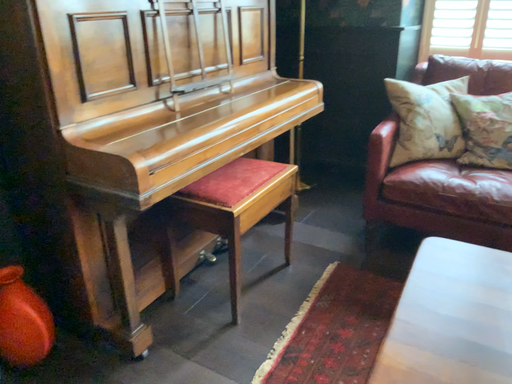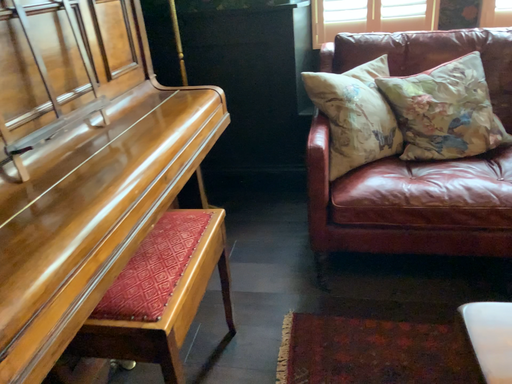
Question: How did the camera likely rotate when shooting the video?

Choices:
 (A) rotated right
 (B) rotated left

Answer: (A)